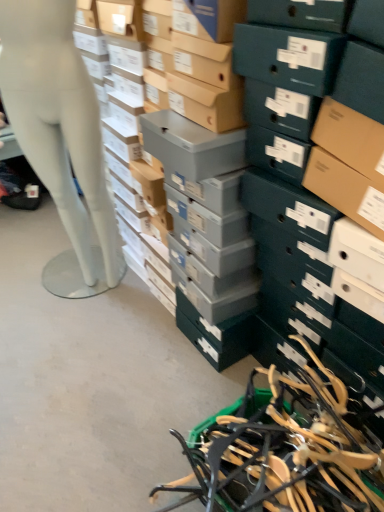
In order to click on vacant region below matte white mannequin at left (from a real-world perspective) in this screenshot , I will do click(90, 292).